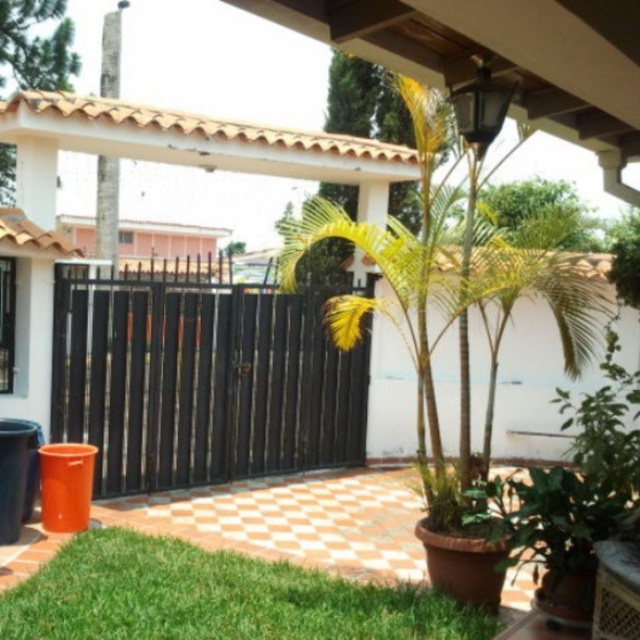
Is black metal gate at center further to the viewer compared to green leafy plant at lower left?

Yes, it is behind green leafy plant at lower left.

Between point (80, 337) and point (288, 632), which one is positioned behind?

The point (80, 337) is behind.

Does point (67, 323) lie behind point (225, 556)?

Yes, it is behind point (225, 556).

Locate an element on the screen. black metal gate at center is located at coordinates (200, 381).